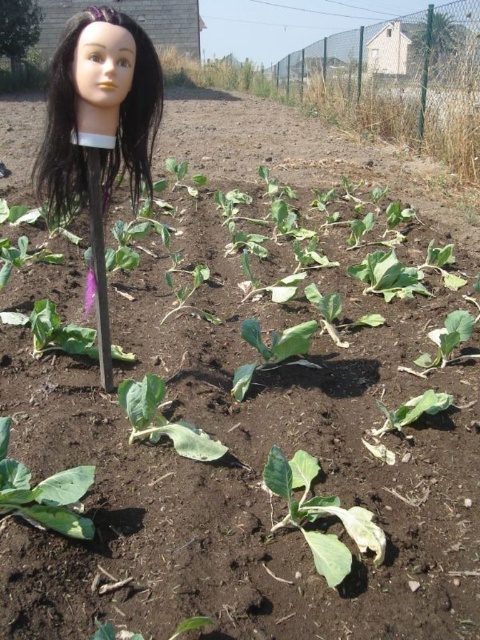
Between point (314, 515) and point (61, 515), which one is positioned in front?

Positioned in front is point (61, 515).

Between green matte leafy vegetable at center and green leafy vegetable at lower left, which one appears on the right side from the viewer's perspective?

Positioned to the right is green matte leafy vegetable at center.

I want to click on green matte leafy vegetable at center, so click(x=321, y=515).

Who is positioned more to the right, black synthetic hair at center or green matte leafy vegetable at center?

From the viewer's perspective, green matte leafy vegetable at center appears more on the right side.

Can you confirm if black synthetic hair at center is taller than green matte leafy vegetable at center?

Indeed, black synthetic hair at center has a greater height compared to green matte leafy vegetable at center.

Which is in front, point (133, 172) or point (377, 544)?

Positioned in front is point (377, 544).

The width and height of the screenshot is (480, 640). I want to click on black synthetic hair at center, so click(x=120, y=118).

Is green leafy vegetable at lower left thinner than green leafy vegetable at center?

Indeed, green leafy vegetable at lower left has a lesser width compared to green leafy vegetable at center.

Is green leafy vegetable at lower left wider than green leafy vegetable at center?

No, green leafy vegetable at lower left is not wider than green leafy vegetable at center.

Is point (71, 477) positioned after point (152, 417)?

No, it is in front of (152, 417).

Where is `green leafy vegetable at lower left`? The image size is (480, 640). green leafy vegetable at lower left is located at coordinates (44, 493).